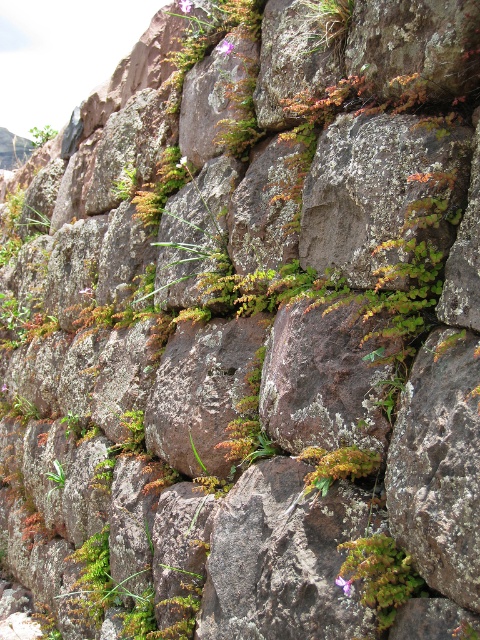
Question: Which object is farther from the camera taking this photo?

Choices:
 (A) green mossy plant at center
 (B) green leafy plant at upper left
 (C) green mossy plant at lower right

Answer: (B)

Question: Can you confirm if green mossy plant at lower right is wider than green mossy rock at upper center?

Choices:
 (A) no
 (B) yes

Answer: (A)

Question: Is green mossy rock at upper center below green leafy plant at upper left?

Choices:
 (A) no
 (B) yes

Answer: (B)

Question: Among these points, which one is nearest to the camera?

Choices:
 (A) (339, 472)
 (B) (348, 13)

Answer: (A)

Question: Is green mossy plant at lower right positioned behind green mossy rock at upper center?

Choices:
 (A) yes
 (B) no

Answer: (B)

Question: Which object appears closest to the camera in this image?

Choices:
 (A) green leafy plant at upper left
 (B) green mossy plant at lower right
 (C) green mossy rock at upper center

Answer: (B)